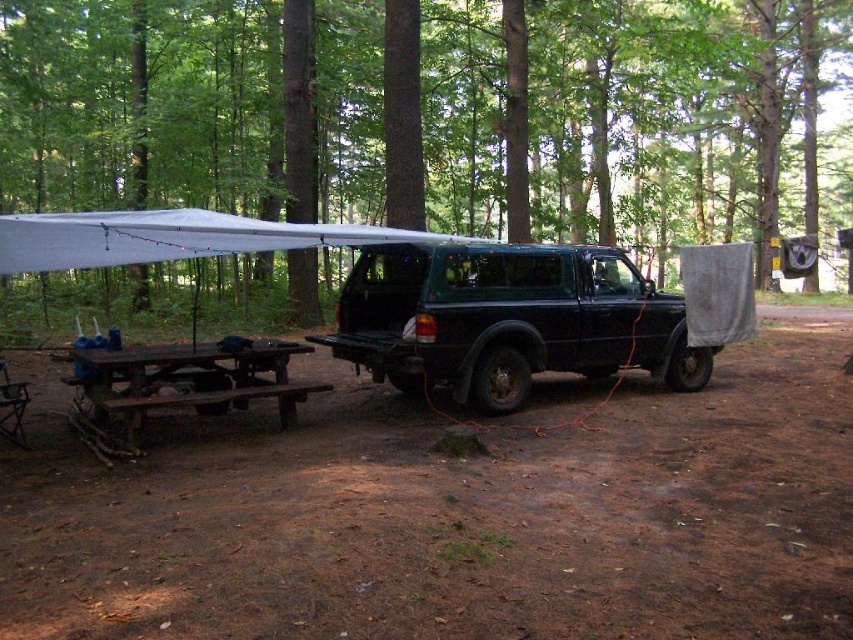
From the picture: You are a photographer planning to capture a wide shot of the camping scene. The green matte tree at center is an important element in your composition. Given that the tree is 37.97 feet away from your current position, can you estimate whether you can include the entire picnic table and the black pickup truck in the frame without moving closer or farther?

The green matte tree at center is 37.97 feet away from the camera. Since the picnic table and black pickup truck are positioned closer to the camera than the tree, they should be within the frame as long as the camera has a wide enough angle to capture the entire scene.

You are standing at the picnic table on the left side of the camping scene. Looking towards the center of the image, what object is located at the coordinates point (184,106)?

At point (184,106) lies green matte tree at center.